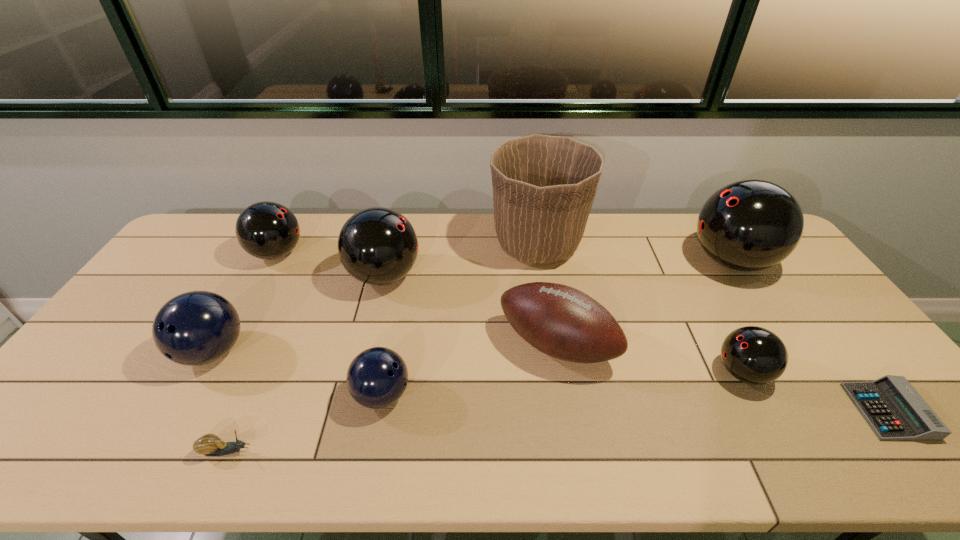
At what (x,y) coordinates should I click in order to perform the action: click on vacant region located 0.190m on the surface of the bigger blue bowling ball near the finger holes. Please return your answer as a coordinate pair (x, y). Image resolution: width=960 pixels, height=540 pixels. Looking at the image, I should click on point(156,454).

You are a GUI agent. You are given a task and a screenshot of the screen. Output one action in this format:
    pyautogui.click(x=<x>, y=<y>)
    Task: Click on the free location located on the front of the brown football (American)
    The height and width of the screenshot is (540, 960).
    Given the screenshot: What is the action you would take?
    pyautogui.click(x=574, y=447)

You are a GUI agent. You are given a task and a screenshot of the screen. Output one action in this format:
    pyautogui.click(x=<x>, y=<y>)
    Task: Click on the vacant space situated 0.270m on the surface of the right blue bowling ball near the finger holes
    Image resolution: width=960 pixels, height=540 pixels.
    Given the screenshot: What is the action you would take?
    pyautogui.click(x=520, y=395)

Locate an element on the screen. Image resolution: width=960 pixels, height=540 pixels. vacant region located 0.050m on the surface of the nearest black bowling ball near the finger holes is located at coordinates tap(695, 373).

Where is `free spot located on the surface of the nearest black bowling ball near the finger holes`? The height and width of the screenshot is (540, 960). free spot located on the surface of the nearest black bowling ball near the finger holes is located at coordinates (684, 373).

This screenshot has width=960, height=540. I want to click on blank area located 0.130m on the surface of the nearest black bowling ball near the finger holes, so click(664, 373).

This screenshot has height=540, width=960. I want to click on free point located on the front-facing side of the nearest object, so click(x=351, y=451).

Locate an element on the screen. The height and width of the screenshot is (540, 960). vacant position located on the back of the calculator is located at coordinates (851, 362).

You are a GUI agent. You are given a task and a screenshot of the screen. Output one action in this format:
    pyautogui.click(x=<x>, y=<y>)
    Task: Click on the flowerpot present at the far edge
    This screenshot has width=960, height=540.
    Given the screenshot: What is the action you would take?
    pyautogui.click(x=544, y=186)

The height and width of the screenshot is (540, 960). Identify the location of escargot that is at the near edge. (209, 444).